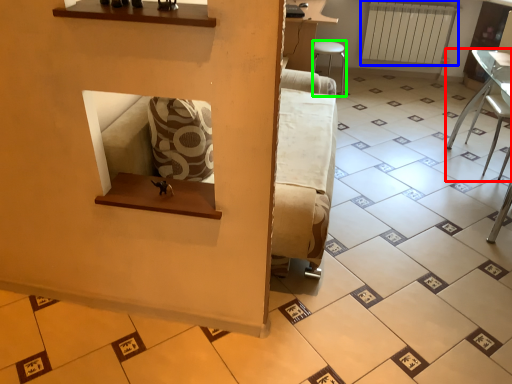
Question: Estimate the real-world distances between objects in this image. Which object is farther from furniture (highlighted by a red box), radiator (highlighted by a blue box) or furniture (highlighted by a green box)?

Choices:
 (A) radiator
 (B) furniture

Answer: (B)